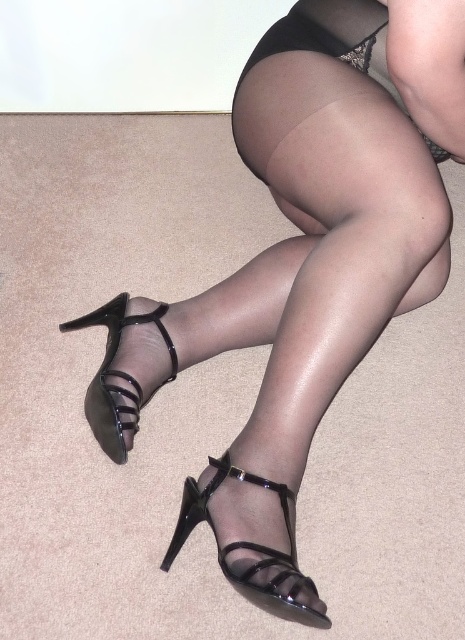
You are a fashion designer trying to create a cohesive outfit. You have a black patent leather sandal at lower center and a black sheer dress at upper center. Which item would you choose to pair with a belt that requires a smaller size? Explain your choice based on their sizes.

The black patent leather sandal at lower center has a smaller size compared to the black sheer dress at upper center. Therefore, the belt should be paired with the black patent leather sandal at lower center since it requires a smaller size.

You are a photographer setting up a shoot. You need to place a prop exactly 30 inches away from the camera to ensure proper focus. The scene includes a black patent leather sandal at lower center. Is the sandal positioned at the correct distance for your prop?

The black patent leather sandal at lower center is 33.05 inches from the camera, which is 3.05 inches further away than the required 30 inches. Therefore, it is not positioned at the correct distance for the prop.